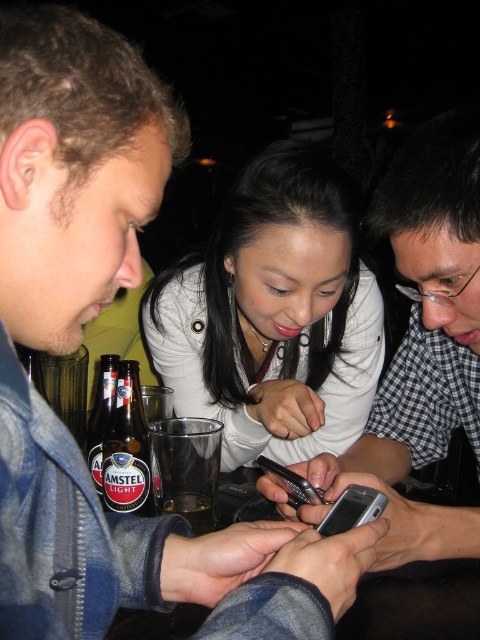
Question: Does amstel light glass bottle at lower left have a greater width compared to silver metallic smartphone at center?

Choices:
 (A) yes
 (B) no

Answer: (A)

Question: Is amber glass beer at lower center further to camera compared to silver metallic smartphone at center?

Choices:
 (A) yes
 (B) no

Answer: (A)

Question: Which point is closer to the camera?

Choices:
 (A) (284, 477)
 (B) (95, 426)
 (C) (171, 508)

Answer: (A)

Question: Estimate the real-world distances between objects in this image. Which object is closer to the silver metallic smartphone at center?

Choices:
 (A) amber glass beer at lower center
 (B) translucent glass at lower center

Answer: (B)

Question: Which object is farther from the camera taking this photo?

Choices:
 (A) amstel light glass bottle at lower left
 (B) white matte jacket at center
 (C) silver metallic smartphone at lower center
 (D) translucent glass at lower center

Answer: (B)

Question: Considering the relative positions of translucent glass at lower center and amber glass beer at lower center in the image provided, where is translucent glass at lower center located with respect to amber glass beer at lower center?

Choices:
 (A) above
 (B) below

Answer: (A)